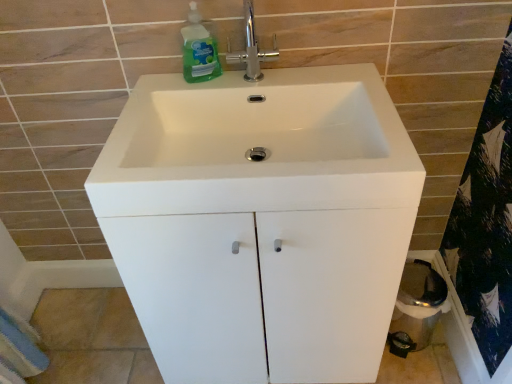
Question: Is white glossy sink at center smaller than green translucent liquid at upper left?

Choices:
 (A) yes
 (B) no

Answer: (B)

Question: From the image's perspective, is white glossy sink at center above green translucent liquid at upper left?

Choices:
 (A) yes
 (B) no

Answer: (B)

Question: Can you confirm if white glossy sink at center is shorter than green translucent liquid at upper left?

Choices:
 (A) no
 (B) yes

Answer: (B)

Question: Can you confirm if white glossy sink at center is wider than green translucent liquid at upper left?

Choices:
 (A) no
 (B) yes

Answer: (B)

Question: Is white glossy sink at center at the left side of green translucent liquid at upper left?

Choices:
 (A) no
 (B) yes

Answer: (A)

Question: Visually, is green translucent liquid at upper left positioned to the left or to the right of blue textured bath towel at lower left?

Choices:
 (A) left
 (B) right

Answer: (B)

Question: Choose the correct answer: Is green translucent liquid at upper left inside blue textured bath towel at lower left or outside it?

Choices:
 (A) outside
 (B) inside

Answer: (A)

Question: Does point (197, 23) appear closer or farther from the camera than point (5, 372)?

Choices:
 (A) farther
 (B) closer

Answer: (B)

Question: From the image's perspective, is green translucent liquid at upper left located above or below blue textured bath towel at lower left?

Choices:
 (A) below
 (B) above

Answer: (B)

Question: Relative to white glossy sink at center, is polished chrome faucet at upper center in front or behind?

Choices:
 (A) front
 (B) behind

Answer: (B)

Question: Which is correct: polished chrome faucet at upper center is inside white glossy sink at center, or outside of it?

Choices:
 (A) inside
 (B) outside

Answer: (B)

Question: From the image's perspective, is polished chrome faucet at upper center located above or below white glossy sink at center?

Choices:
 (A) below
 (B) above

Answer: (B)

Question: In terms of height, does polished chrome faucet at upper center look taller or shorter compared to white glossy sink at center?

Choices:
 (A) short
 (B) tall

Answer: (B)

Question: Considering their positions, is green translucent liquid at upper left located in front of or behind white glossy sink at center?

Choices:
 (A) behind
 (B) front

Answer: (A)

Question: Would you say green translucent liquid at upper left is inside or outside white glossy sink at center?

Choices:
 (A) inside
 (B) outside

Answer: (B)